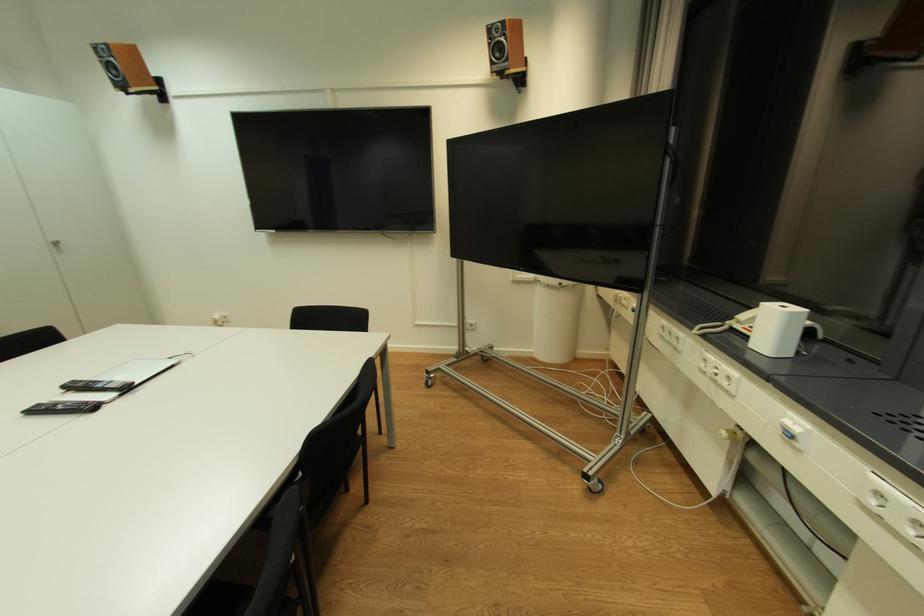
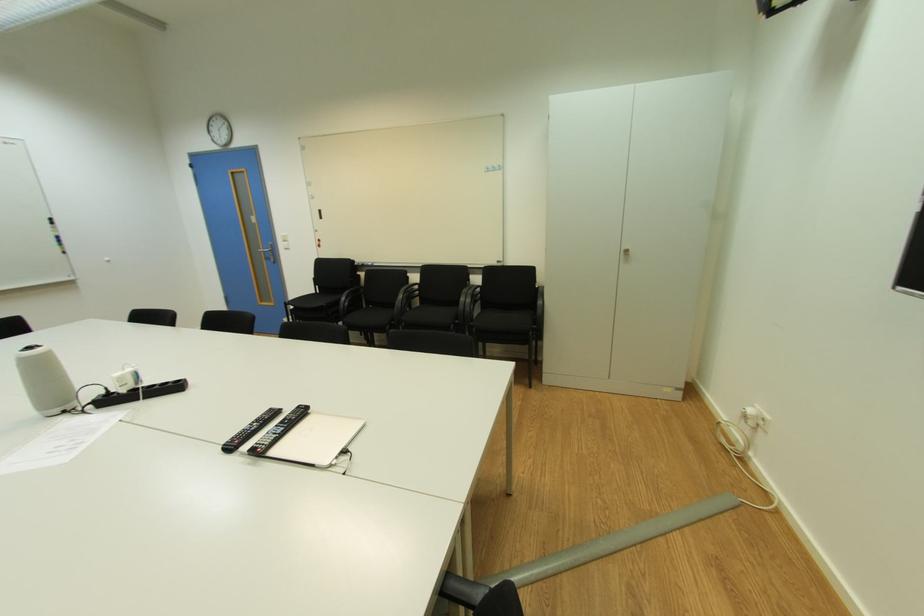
The point at (223, 318) is marked in the first image. Where is the corresponding point in the second image?

(757, 411)